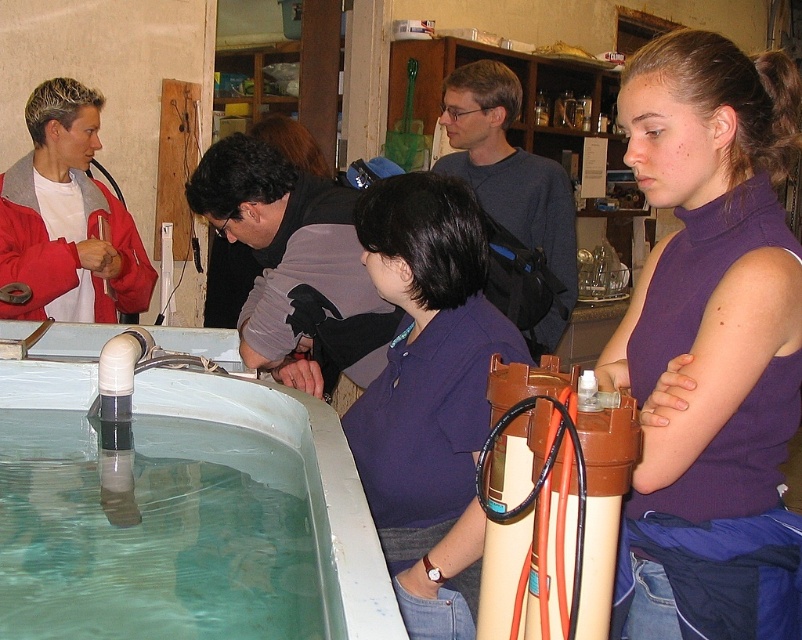
Question: Based on their relative distances, which object is nearer to the purple cotton shirt at center?

Choices:
 (A) white plastic tub at lower left
 (B) purple turtleneck at center
 (C) matte white shirt at upper left

Answer: (A)

Question: Estimate the real-world distances between objects in this image. Which object is farther from the purple cotton shirt at center?

Choices:
 (A) purple turtleneck at center
 (B) white plastic tub at lower left

Answer: (A)

Question: Is purple turtleneck at center bigger than purple cotton shirt at center?

Choices:
 (A) no
 (B) yes

Answer: (B)

Question: Among these objects, which one is nearest to the camera?

Choices:
 (A) purple cotton shirt at center
 (B) white plastic tub at lower left
 (C) purple turtleneck at center

Answer: (B)

Question: Can you confirm if purple cotton shirt at center is wider than white plastic tub at lower left?

Choices:
 (A) yes
 (B) no

Answer: (B)

Question: Where is purple cotton shirt at center located in relation to matte white shirt at upper left in the image?

Choices:
 (A) right
 (B) left

Answer: (A)